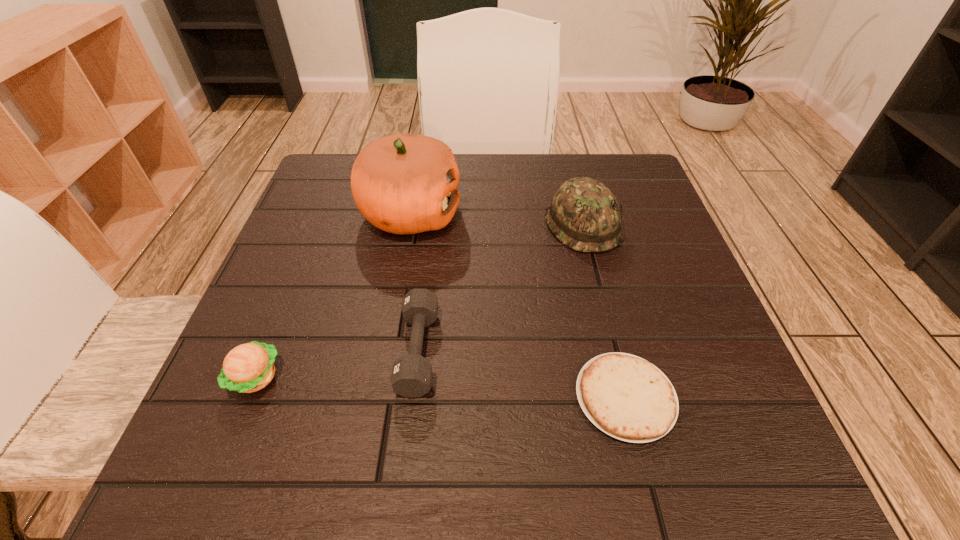
Identify the location of vacant area that satisfies the following two spatial constraints: 1. on the back side of the leftmost object; 2. on the right side of the headwear. The height and width of the screenshot is (540, 960). (317, 225).

Where is `free location that satisfies the following two spatial constraints: 1. on the front side of the tortilla; 2. on the left side of the leftmost object`? This screenshot has height=540, width=960. free location that satisfies the following two spatial constraints: 1. on the front side of the tortilla; 2. on the left side of the leftmost object is located at coordinates tap(248, 397).

This screenshot has height=540, width=960. Find the location of `vacant space that satisfies the following two spatial constraints: 1. on the front side of the shortest object; 2. on the left side of the dumbbell`. vacant space that satisfies the following two spatial constraints: 1. on the front side of the shortest object; 2. on the left side of the dumbbell is located at coordinates (413, 397).

Locate an element on the screen. The width and height of the screenshot is (960, 540). vacant space that satisfies the following two spatial constraints: 1. on the back side of the shortest object; 2. on the left side of the fourth shortest object is located at coordinates (582, 225).

Locate an element on the screen. This screenshot has width=960, height=540. free space that satisfies the following two spatial constraints: 1. on the face of the tallest object; 2. on the right side of the tortilla is located at coordinates (378, 397).